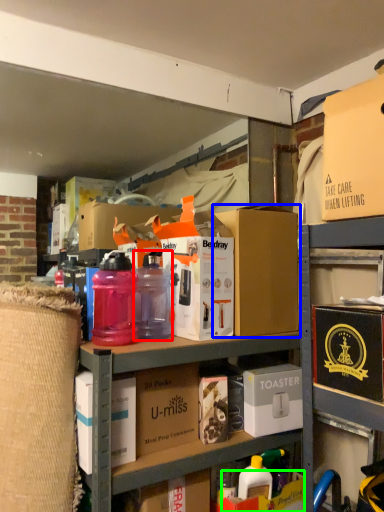
Question: Based on their relative distances, which object is nearer to bottle (highlighted by a red box)? Choose from box (highlighted by a blue box) and storage box (highlighted by a green box).

Choices:
 (A) box
 (B) storage box

Answer: (A)